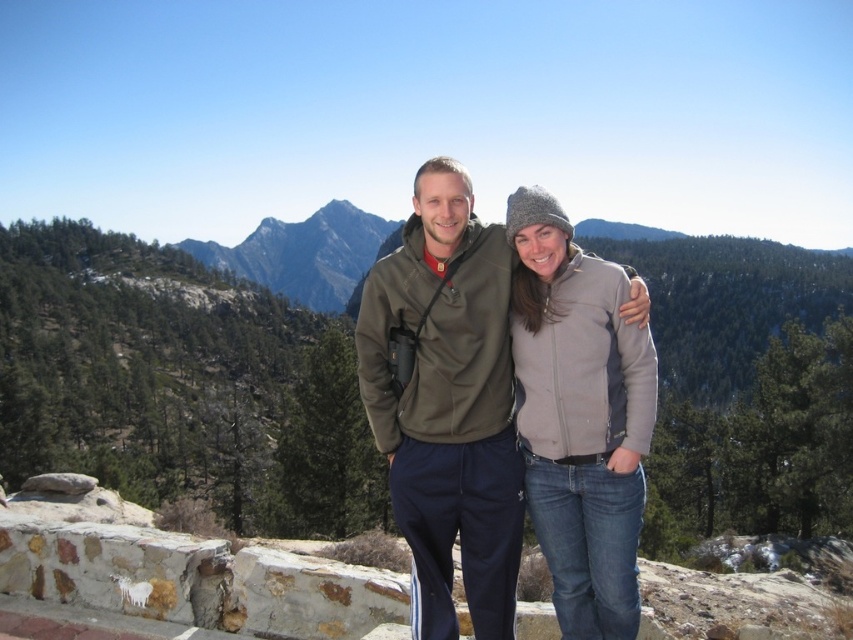
Who is taller, matte olive-green jacket at center or gray fleece jacket at center?

matte olive-green jacket at center

Is matte olive-green jacket at center to the left of gray fleece jacket at center from the viewer's perspective?

Indeed, matte olive-green jacket at center is positioned on the left side of gray fleece jacket at center.

This screenshot has width=853, height=640. Find the location of `matte olive-green jacket at center`. matte olive-green jacket at center is located at coordinates (445, 403).